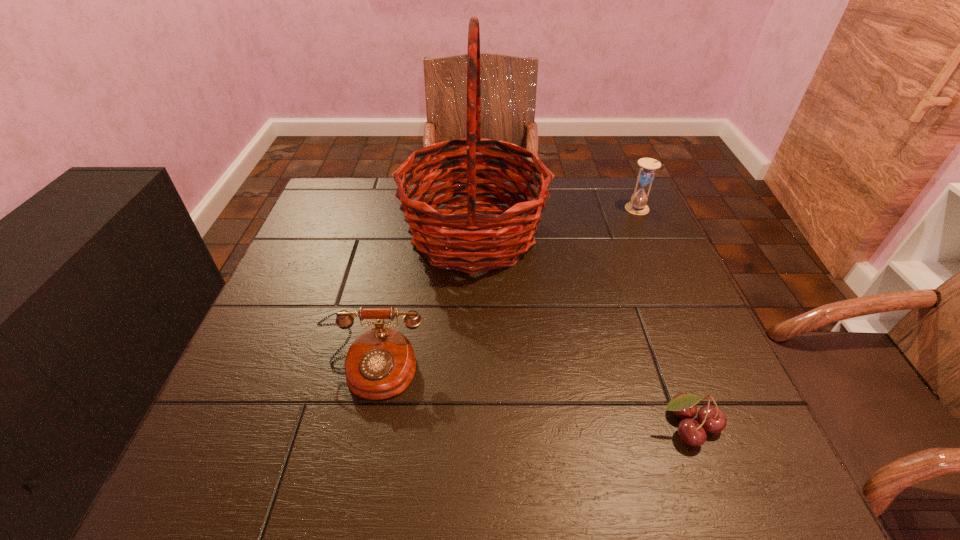
This screenshot has width=960, height=540. In order to click on free space that is in between the basket and the hourglass in this screenshot , I will do `click(556, 222)`.

Identify the location of free space between the cherry and the hourglass. The height and width of the screenshot is (540, 960). (662, 318).

What are the coordinates of `free area in between the cherry and the telephone` in the screenshot? It's located at (530, 398).

Identify which object is the nearest to the third shortest object. Please provide its 2D coordinates. Your answer should be formatted as a tuple, i.e. [(x, y)], where the tuple contains the x and y coordinates of a point satisfying the conditions above.

[(452, 234)]

This screenshot has height=540, width=960. In order to click on object that is the closest to the cherry in this screenshot , I will do `click(452, 234)`.

Locate an element on the screen. The image size is (960, 540). vacant area that satisfies the following two spatial constraints: 1. on the back side of the tallest object; 2. on the right side of the hourglass is located at coordinates (474, 210).